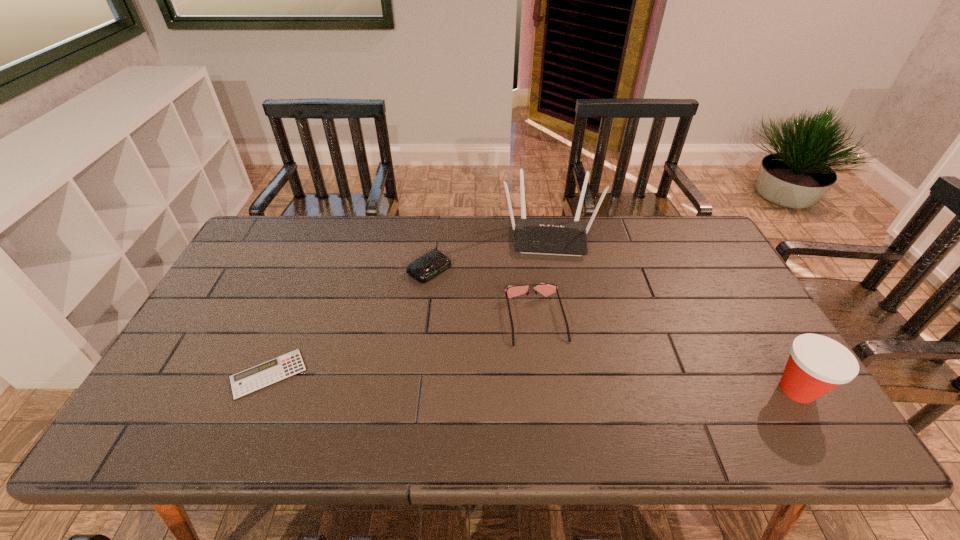
You are a GUI agent. You are given a task and a screenshot of the screen. Output one action in this format:
    pyautogui.click(x=<x>, y=<y>)
    Task: Click on the free space on the desktop that is between the leftmost object and the Dixie cup and is positioned on the display of the second object from left to right
    
    Given the screenshot: What is the action you would take?
    pyautogui.click(x=591, y=383)

Where is `vacant space on the desktop that is between the calculator and the Dixie cup and is positioned on the bridge of the third tallest object`? vacant space on the desktop that is between the calculator and the Dixie cup and is positioned on the bridge of the third tallest object is located at coordinates (551, 382).

At what (x,y) coordinates should I click in order to perform the action: click on free space on the desktop that is between the shortest object and the second tallest object and is positioned on the front-facing side of the tallest object. Please return your answer as a coordinate pair (x, y). Looking at the image, I should click on (558, 382).